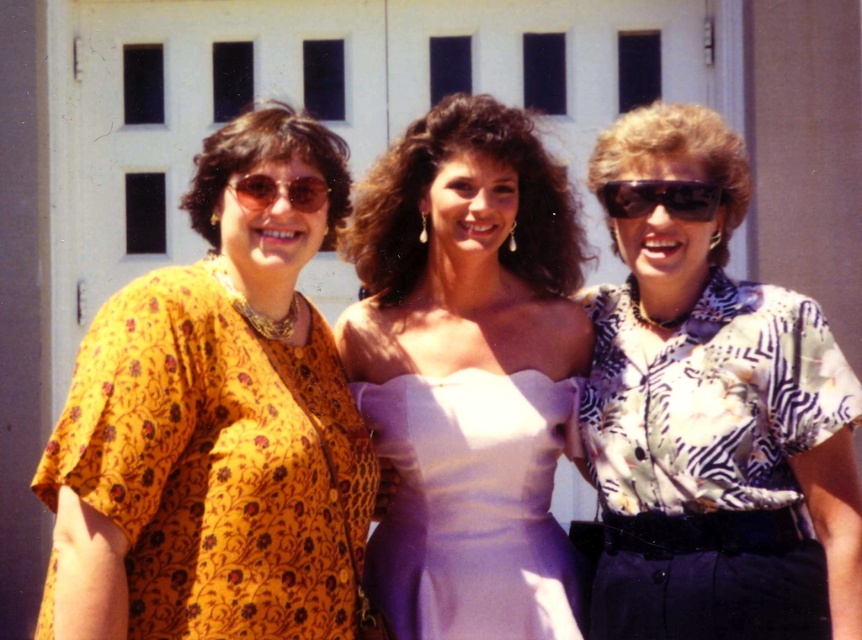
You are a fashion designer observing the three women. You need to determine which item of clothing or accessory is wider between the yellow floral blouse at left and the matte plastic sunglasses at center. Which one is wider?

The yellow floral blouse at left is wider than the matte plastic sunglasses at center.

You are a photographer trying to adjust the composition of this group photo. The yellow floral blouse at left and the matte white dress at center are currently positioned in a way that might cause a visual imbalance. Based on their current positions, which clothing item is lower in the frame?

The yellow floral blouse at left is below the matte white dress at center, so it is lower in the frame.

You are standing in front of the three women and want to determine which of the two points, point (397,324) or point (317,208), is closer to you. Based on their positions, which one is nearer?

Point (397,324) is further to the viewer than point (317,208), so the closer point to you is point (317,208).